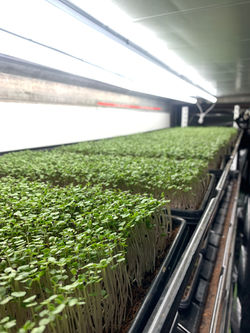
Locate an element on the screen. bottom left corner empty space is located at coordinates (2, 330).